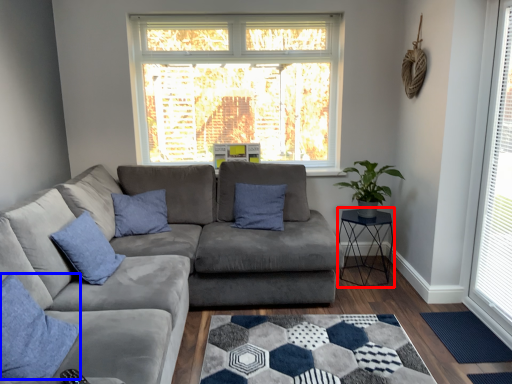
Question: Which object appears farthest to the camera in this image, cocktail table (highlighted by a red box) or pillow (highlighted by a blue box)?

Choices:
 (A) cocktail table
 (B) pillow

Answer: (A)